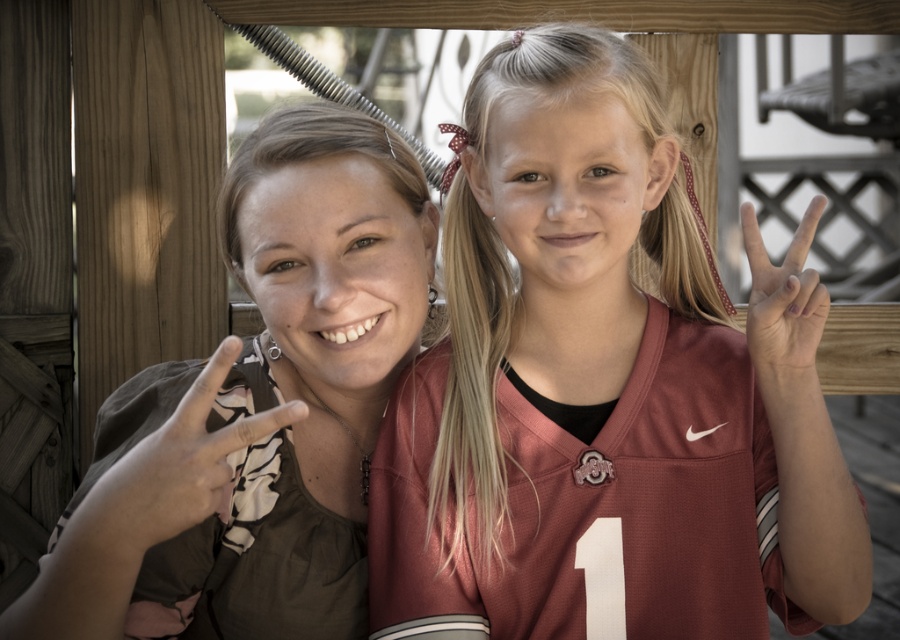
How far apart are matte jersey at center and matte brown shirt at left?

A distance of 10.09 inches exists between matte jersey at center and matte brown shirt at left.

Is matte jersey at center in front of matte brown shirt at left?

That is False.

Is point (684, 586) less distant than point (393, 166)?

Yes, it is in front of point (393, 166).

Identify the location of matte jersey at center. The width and height of the screenshot is (900, 640). (605, 390).

Does matte jersey at center have a smaller size compared to matte red jersey at right?

Actually, matte jersey at center might be larger than matte red jersey at right.

Does matte jersey at center appear under matte red jersey at right?

Yes, matte jersey at center is below matte red jersey at right.

You are a GUI agent. You are given a task and a screenshot of the screen. Output one action in this format:
    pyautogui.click(x=<x>, y=<y>)
    Task: Click on the matte jersey at center
    Image resolution: width=900 pixels, height=640 pixels.
    Given the screenshot: What is the action you would take?
    (x=605, y=390)

Is point (280, 221) closer to camera compared to point (758, 260)?

That is False.

Between matte brown shirt at left and matte red jersey at right, which one has less height?

Standing shorter between the two is matte red jersey at right.

Locate an element on the screen. matte brown shirt at left is located at coordinates (257, 412).

Find the location of a particular element. matte brown shirt at left is located at coordinates (257, 412).